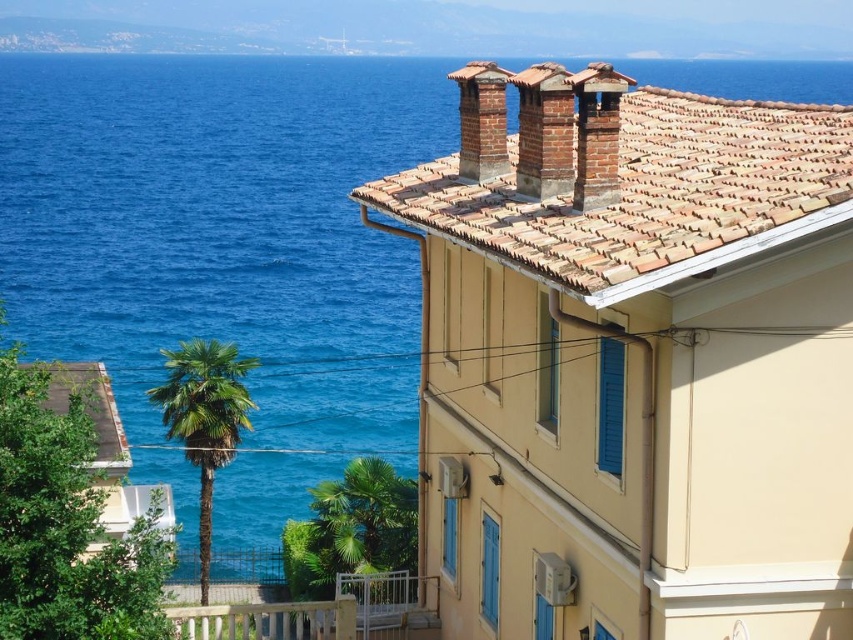
What are the coordinates of `white painted wood at lower center` in the screenshot? It's located at (323, 612).

Is point (340, 632) less distant than point (407, 552)?

Yes.

Find the location of a particular element. Image resolution: width=853 pixels, height=640 pixels. white painted wood at lower center is located at coordinates tap(323, 612).

Is green leafy palm tree at center shorter than green leafy palm tree at center-left?

Yes, green leafy palm tree at center is shorter than green leafy palm tree at center-left.

Is green leafy palm tree at center below green leafy palm tree at center-left?

Yes.

Who is more distant from viewer, [402,561] or [170,397]?

Positioned behind is point [170,397].

Where is `green leafy palm tree at center`? This screenshot has height=640, width=853. green leafy palm tree at center is located at coordinates (360, 524).

Between white painted wood at lower center and green leafy palm tree at center-left, which one has more height?

With more height is green leafy palm tree at center-left.

What do you see at coordinates (323, 612) in the screenshot? The image size is (853, 640). I see `white painted wood at lower center` at bounding box center [323, 612].

Where is `white painted wood at lower center`? white painted wood at lower center is located at coordinates (323, 612).